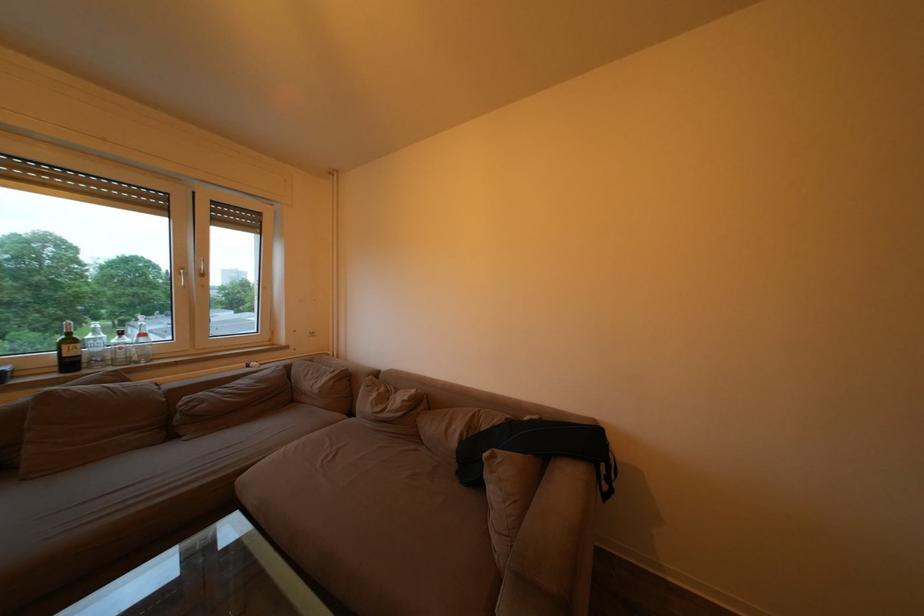
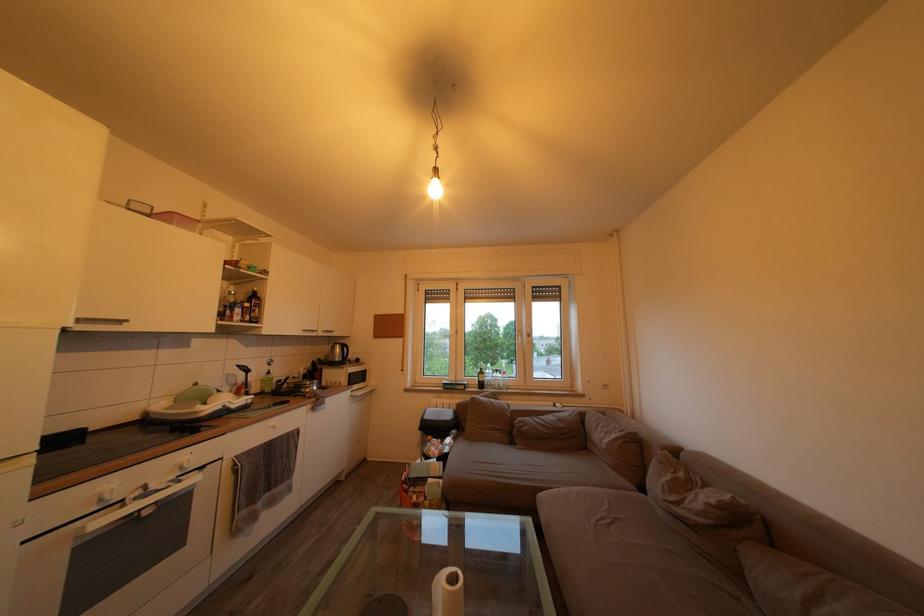
Question: The images are taken continuously from a first-person perspective. In which direction is your viewpoint rotating?

Choices:
 (A) Left
 (B) Right
 (C) Up
 (D) Down

Answer: (A)